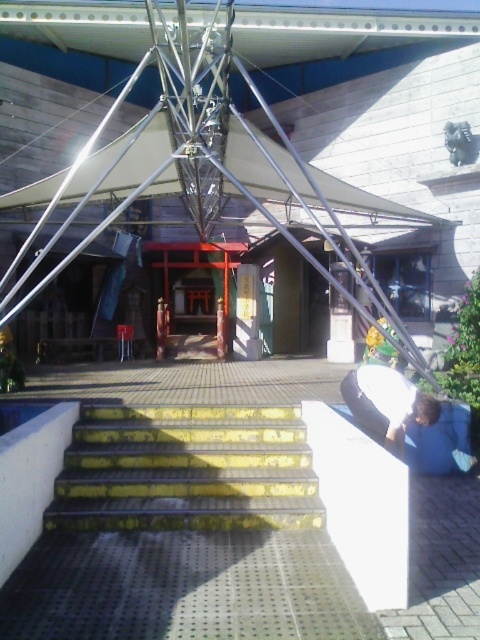
Question: Does yellow painted concrete stairs at center appear over blue fabric shirt at lower right?

Choices:
 (A) no
 (B) yes

Answer: (A)

Question: Is yellow painted concrete stairs at center bigger than blue fabric shirt at lower right?

Choices:
 (A) yes
 (B) no

Answer: (A)

Question: Which of the following is the farthest from the observer?

Choices:
 (A) (248, 406)
 (B) (365, 429)

Answer: (A)

Question: Does yellow painted concrete stairs at center appear under blue fabric shirt at lower right?

Choices:
 (A) no
 (B) yes

Answer: (B)